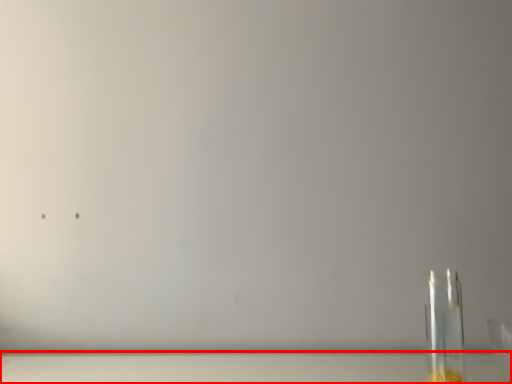
Question: From the image's perspective, considering the relative positions of table top (annotated by the red box) and bottle in the image provided, where is table top (annotated by the red box) located with respect to the staircase?

Choices:
 (A) below
 (B) above

Answer: (A)